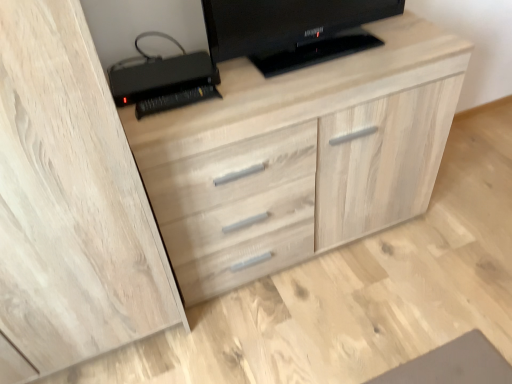
Question: From a real-world perspective, is black glossy television at upper center under black plastic printer at upper left?

Choices:
 (A) no
 (B) yes

Answer: (A)

Question: From the image's perspective, would you say black glossy television at upper center is positioned over black plastic printer at upper left?

Choices:
 (A) yes
 (B) no

Answer: (A)

Question: Is black glossy television at upper center oriented away from black plastic printer at upper left?

Choices:
 (A) yes
 (B) no

Answer: (B)

Question: Is black glossy television at upper center oriented towards black plastic printer at upper left?

Choices:
 (A) no
 (B) yes

Answer: (A)

Question: Is black glossy television at upper center placed right next to black plastic printer at upper left?

Choices:
 (A) yes
 (B) no

Answer: (B)

Question: From a real-world perspective, is black glossy television at upper center above or below black plastic printer at upper left?

Choices:
 (A) below
 (B) above

Answer: (B)

Question: Is black glossy television at upper center taller or shorter than black plastic printer at upper left?

Choices:
 (A) tall
 (B) short

Answer: (A)

Question: Looking at the image, does black glossy television at upper center seem bigger or smaller compared to black plastic printer at upper left?

Choices:
 (A) small
 (B) big

Answer: (B)

Question: From the image's perspective, is black glossy television at upper center positioned above or below black plastic printer at upper left?

Choices:
 (A) below
 (B) above

Answer: (B)

Question: Is light wood dresser at center in front of or behind black plastic printer at upper left in the image?

Choices:
 (A) front
 (B) behind

Answer: (A)

Question: Is light wood dresser at center wider or thinner than black plastic printer at upper left?

Choices:
 (A) wide
 (B) thin

Answer: (A)

Question: From their relative heights in the image, would you say light wood dresser at center is taller or shorter than black plastic printer at upper left?

Choices:
 (A) tall
 (B) short

Answer: (A)

Question: Is point (315, 210) positioned closer to the camera than point (205, 81)?

Choices:
 (A) farther
 (B) closer

Answer: (A)

Question: Visually, is black glossy television at upper center positioned to the left or to the right of light wood dresser at center?

Choices:
 (A) left
 (B) right

Answer: (B)

Question: From a real-world perspective, is black glossy television at upper center positioned above or below light wood dresser at center?

Choices:
 (A) below
 (B) above

Answer: (B)